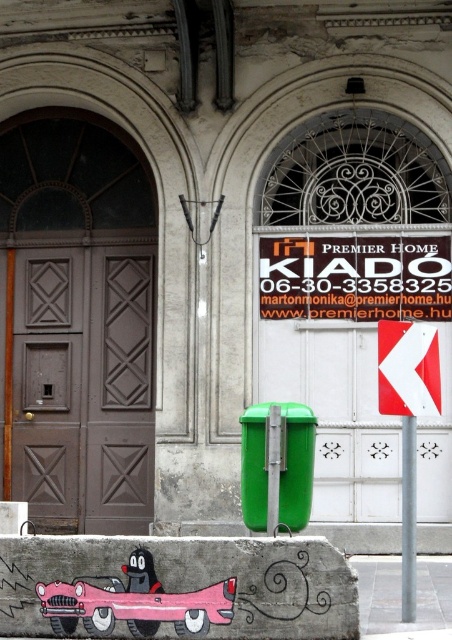
Question: Is pink matte toy car at lower left thinner than white reflective arrow at center right?

Choices:
 (A) yes
 (B) no

Answer: (B)

Question: Does white plastic sign at upper center have a smaller size compared to white reflective arrow at center right?

Choices:
 (A) no
 (B) yes

Answer: (A)

Question: Which of the following is the closest to the observer?

Choices:
 (A) pink matte toy car at lower left
 (B) white reflective arrow at center right

Answer: (A)

Question: Based on their relative distances, which object is farther from the white reflective arrow at center right?

Choices:
 (A) white plastic sign at upper center
 (B) pink matte toy car at lower left

Answer: (A)

Question: Can you confirm if pink matte toy car at lower left is positioned above white reflective arrow at center right?

Choices:
 (A) no
 (B) yes

Answer: (A)

Question: Which point is farther to the camera?

Choices:
 (A) white plastic sign at upper center
 (B) white reflective arrow at center right
 (C) pink matte toy car at lower left

Answer: (A)